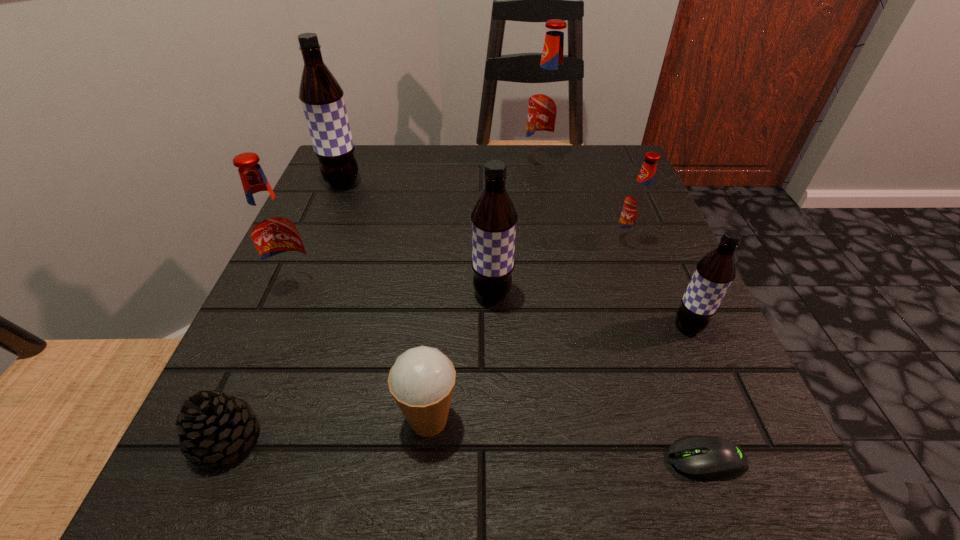
I want to click on vacant region at the far right corner of the desktop, so click(x=590, y=166).

Where is `free space between the leftmost red root beer and the fourth object from right to left`? free space between the leftmost red root beer and the fourth object from right to left is located at coordinates (419, 224).

This screenshot has width=960, height=540. In order to click on free space between the gray computer mouse and the pinecone in this screenshot , I will do `click(466, 449)`.

Find the location of a particular element. free space between the icecream and the second nearest brown root beer is located at coordinates (461, 357).

Identify the location of free area in between the gray computer mouse and the second farthest red root beer. The image size is (960, 540). (667, 350).

This screenshot has width=960, height=540. Find the location of `free space that is in between the leftmost red root beer and the fifth nearest root beer`. free space that is in between the leftmost red root beer and the fifth nearest root beer is located at coordinates (319, 234).

At what (x,y) coordinates should I click in order to perform the action: click on vacant area that lies between the smallest red root beer and the gray computer mouse. Please return your answer as a coordinate pair (x, y). The height and width of the screenshot is (540, 960). Looking at the image, I should click on (667, 350).

Where is `vacant space in between the second nearest red root beer and the gray computer mouse`? Image resolution: width=960 pixels, height=540 pixels. vacant space in between the second nearest red root beer and the gray computer mouse is located at coordinates (667, 350).

Find the location of `free area in between the shortest object and the fifth nearest root beer`. free area in between the shortest object and the fifth nearest root beer is located at coordinates (524, 321).

The image size is (960, 540). Identify the location of vacant space in between the fourth root beer from right to left and the pinecone. (359, 366).